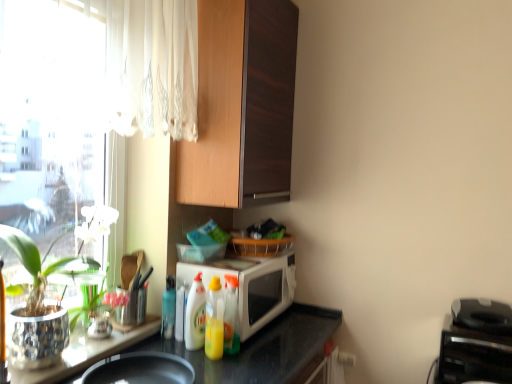
Find the location of a particular element. empty space that is ontop of metallic silver table at lower left (from a real-world perspective) is located at coordinates (100, 337).